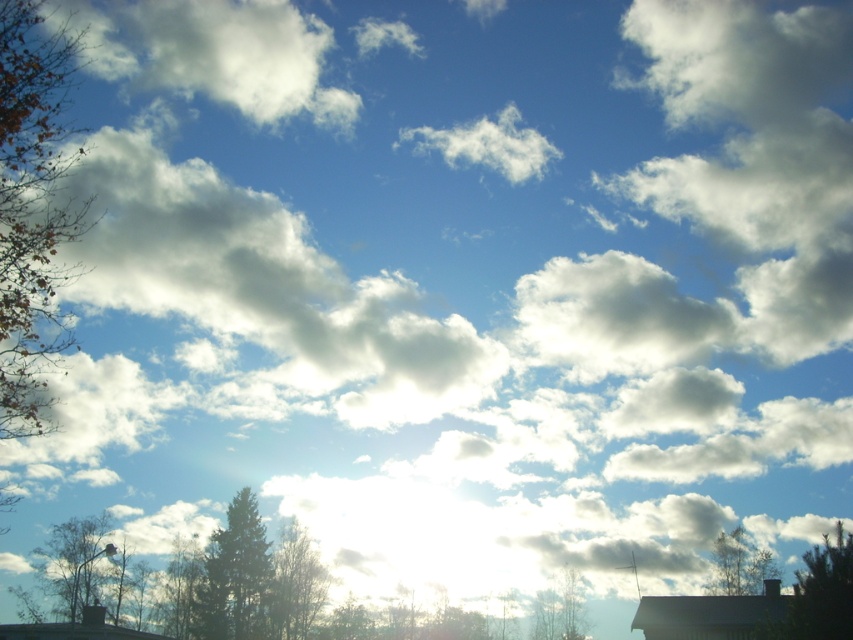
Question: Where is green leafy tree at lower left located in relation to green leafy tree at lower center in the image?

Choices:
 (A) right
 (B) left

Answer: (B)

Question: Among these objects, which one is farthest from the camera?

Choices:
 (A) white fluffy cloud at upper center
 (B) green leafy tree at lower right
 (C) green leafy tree at lower center
 (D) green matte tree at lower center

Answer: (A)

Question: Can you confirm if green leafy tree at lower left is positioned to the left of green leafy tree at lower right?

Choices:
 (A) no
 (B) yes

Answer: (B)

Question: Which point is closer to the camera taking this photo?

Choices:
 (A) (840, 548)
 (B) (749, 577)
 (C) (218, 556)
 (D) (47, 125)

Answer: (D)

Question: Estimate the real-world distances between objects in this image. Which object is closer to the green leafy tree at upper right?

Choices:
 (A) green matte tree at lower center
 (B) green leafy tree at lower left
 (C) brown leafy tree at left
 (D) green leafy tree at lower center

Answer: (D)

Question: Considering the relative positions of white fluffy cloud at center and brown leafy tree at left in the image provided, where is white fluffy cloud at center located with respect to brown leafy tree at left?

Choices:
 (A) right
 (B) left

Answer: (B)